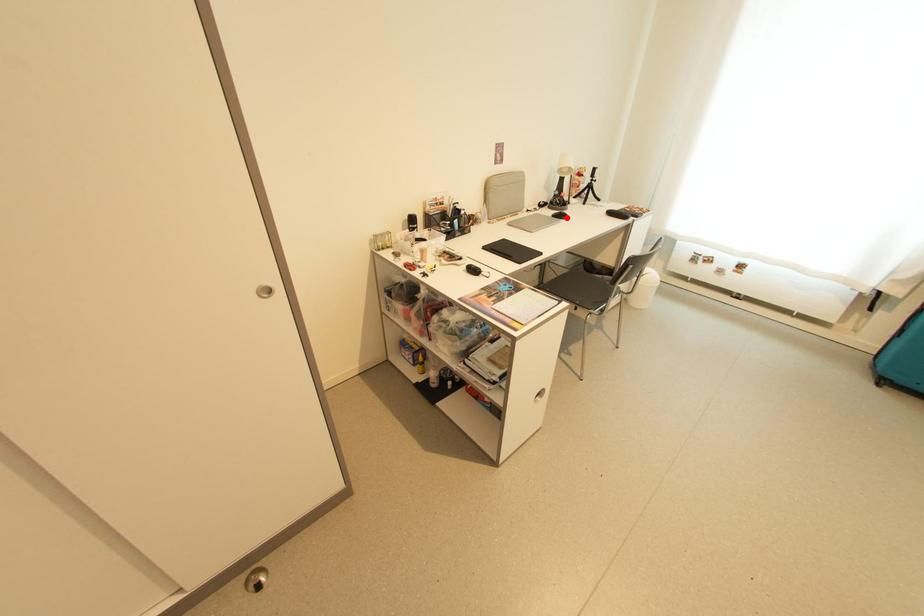
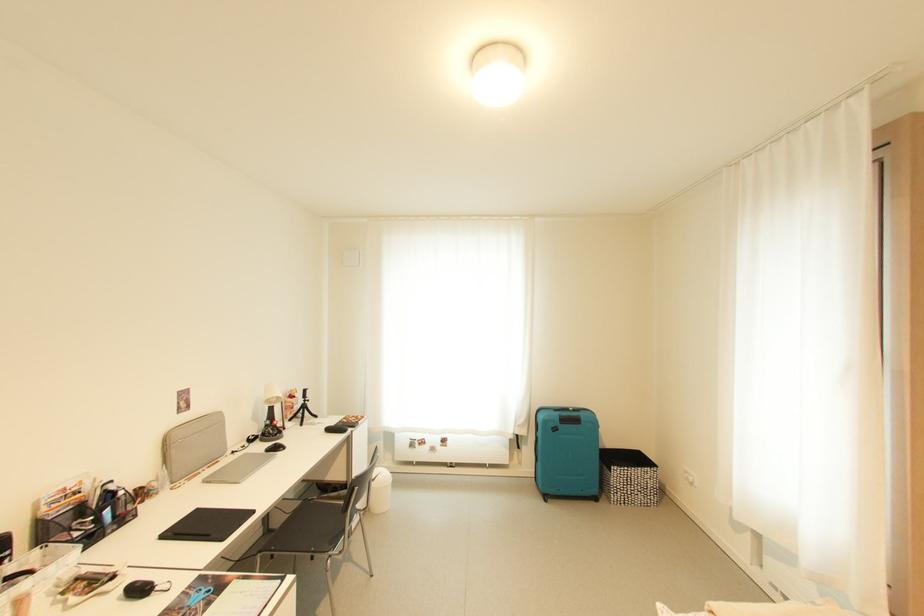
The point at the highlighted location is marked in the first image. Where is the corresponding point in the second image?

(282, 450)